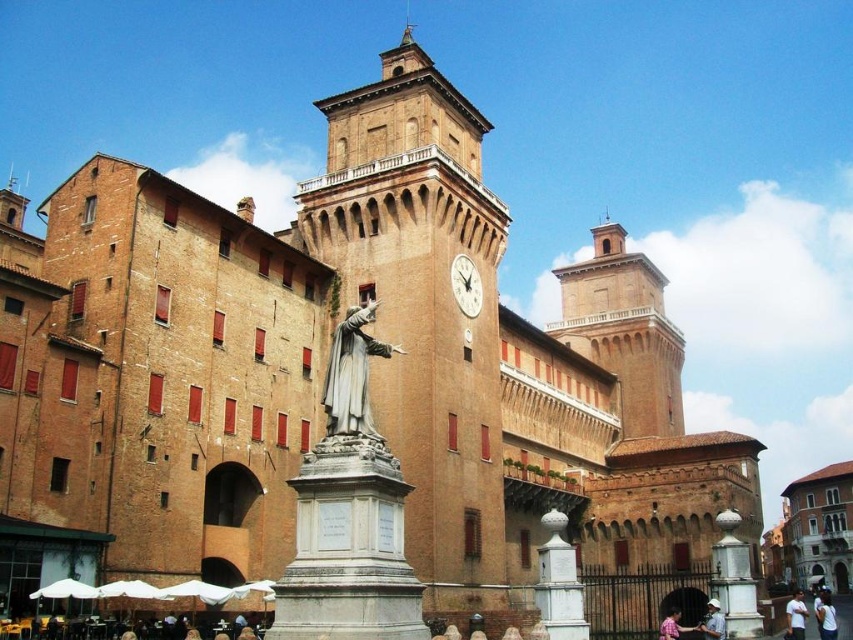
You are standing in front of the historic building and want to take a photo of the white cotton shirt at center. Where should you position yourself to capture the shirt in the frame?

The white cotton shirt at center is located at point coordinates 0.964 on the x axis and 0.933 on the y axis, so you should position yourself directly in front of the shirt at those coordinates to capture it in the frame.

You are standing in front of the historic building and notice two objects in the scene. One is the brown brick tower at upper center and the other is the white fabric hat at lower center. Based on their positions, which object is located to the right side of the other?

The brown brick tower at upper center is located to the right of the white fabric hat at lower center.